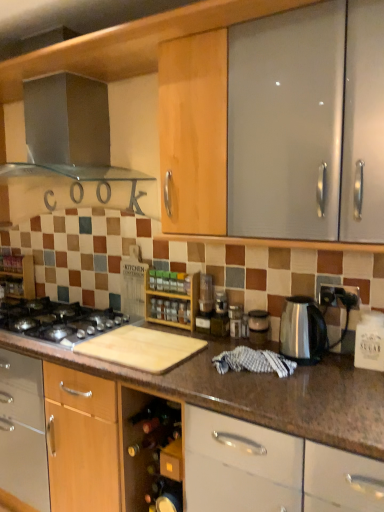
Question: Could you tell me if transparent plastic container at center, which is counted as the 2th appliance, starting from the left, is turned towards black matte gas stove at lower left?

Choices:
 (A) yes
 (B) no

Answer: (B)

Question: Considering the relative positions of transparent plastic container at center, which is counted as the 2th appliance, starting from the left, and black matte gas stove at lower left in the image provided, is transparent plastic container at center, which is counted as the 2th appliance, starting from the left, to the right of black matte gas stove at lower left from the viewer's perspective?

Choices:
 (A) no
 (B) yes

Answer: (B)

Question: Is the position of transparent plastic container at center, which is the 1th appliance in right-to-left order, less distant than that of black matte gas stove at lower left?

Choices:
 (A) yes
 (B) no

Answer: (B)

Question: Does transparent plastic container at center, which is the 1th appliance in right-to-left order, have a greater height compared to black matte gas stove at lower left?

Choices:
 (A) yes
 (B) no

Answer: (A)

Question: Can black matte gas stove at lower left be found inside transparent plastic container at center, which is the 1th appliance in right-to-left order?

Choices:
 (A) no
 (B) yes

Answer: (A)

Question: From a real-world perspective, is transparent plastic container at center, which is counted as the 2th appliance, starting from the left, physically above black matte gas stove at lower left?

Choices:
 (A) yes
 (B) no

Answer: (A)

Question: Can you confirm if wooden spice rack at center, the second shelf positioned from the left, is positioned to the right of stainless steel kettle at right, which ranks as the 1th kitchen appliance in bottom-to-top order?

Choices:
 (A) yes
 (B) no

Answer: (B)

Question: Can you confirm if wooden spice rack at center, the 2th shelf in the back-to-front sequence, is taller than stainless steel kettle at right, which is the 2th kitchen appliance from left to right?

Choices:
 (A) yes
 (B) no

Answer: (A)

Question: Is wooden spice rack at center, the first shelf viewed from the right, directly adjacent to stainless steel kettle at right, acting as the 2th kitchen appliance starting from the top?

Choices:
 (A) yes
 (B) no

Answer: (B)

Question: Is wooden spice rack at center, the first shelf viewed from the right, facing away from stainless steel kettle at right, which ranks as the 2th kitchen appliance in back-to-front order?

Choices:
 (A) no
 (B) yes

Answer: (A)

Question: From the image's perspective, is wooden spice rack at center, the first shelf viewed from the right, on top of stainless steel kettle at right, which ranks as the 1th kitchen appliance in bottom-to-top order?

Choices:
 (A) no
 (B) yes

Answer: (B)

Question: From a real-world perspective, is wooden spice rack at center, the second shelf positioned from the left, under stainless steel kettle at right, which ranks as the 1th kitchen appliance in bottom-to-top order?

Choices:
 (A) yes
 (B) no

Answer: (B)

Question: Does wooden spice rack at left, acting as the second shelf starting from the front, come behind transparent plastic container at center, which is the 1th appliance in right-to-left order?

Choices:
 (A) yes
 (B) no

Answer: (A)